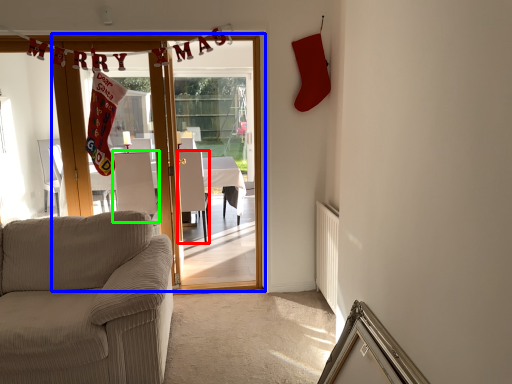
Question: Based on their relative distances, which object is nearer to armchair (highlighted by a red box)? Choose from door (highlighted by a blue box) and armchair (highlighted by a green box).

Choices:
 (A) door
 (B) armchair

Answer: (B)